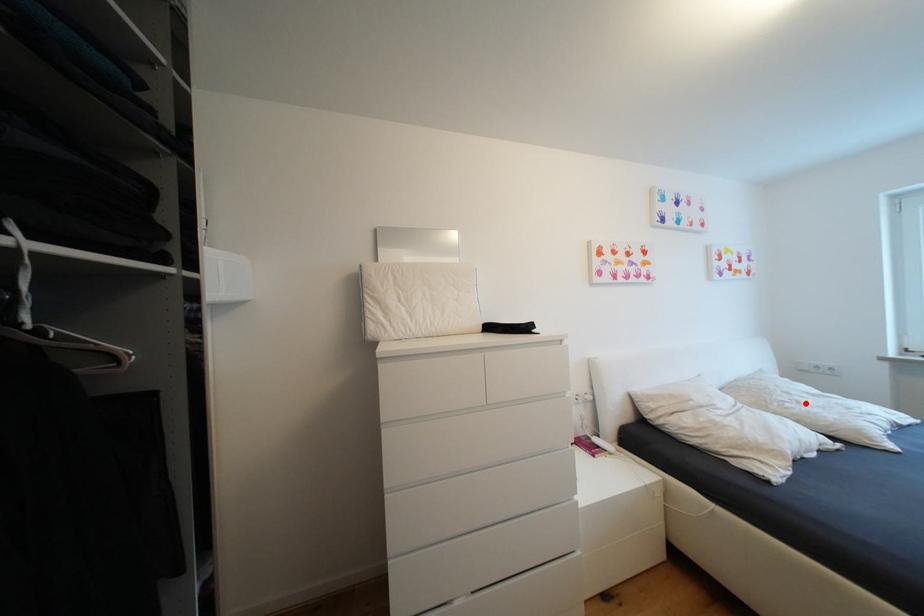
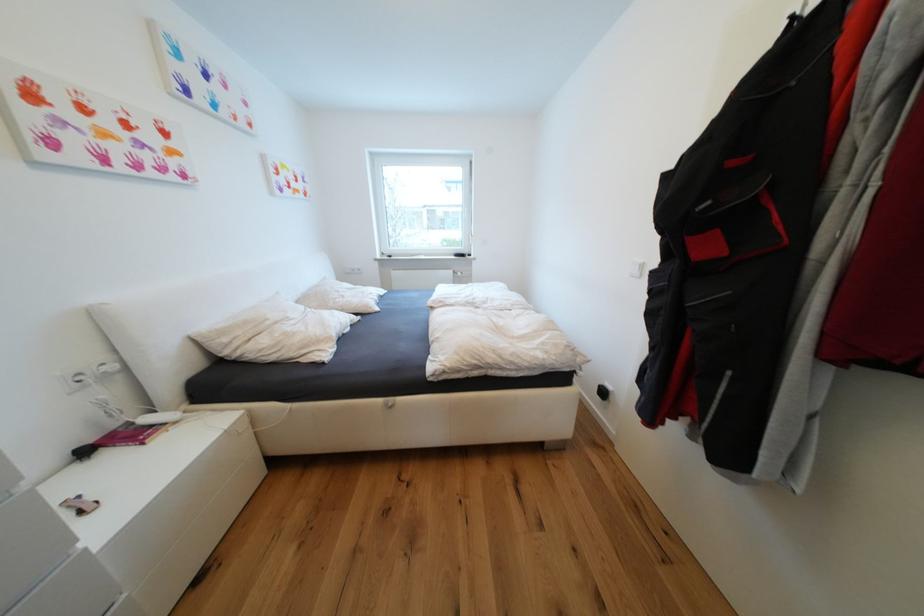
Locate, in the second image, the point that corresponds to the highlighted location in the first image.

(349, 297)